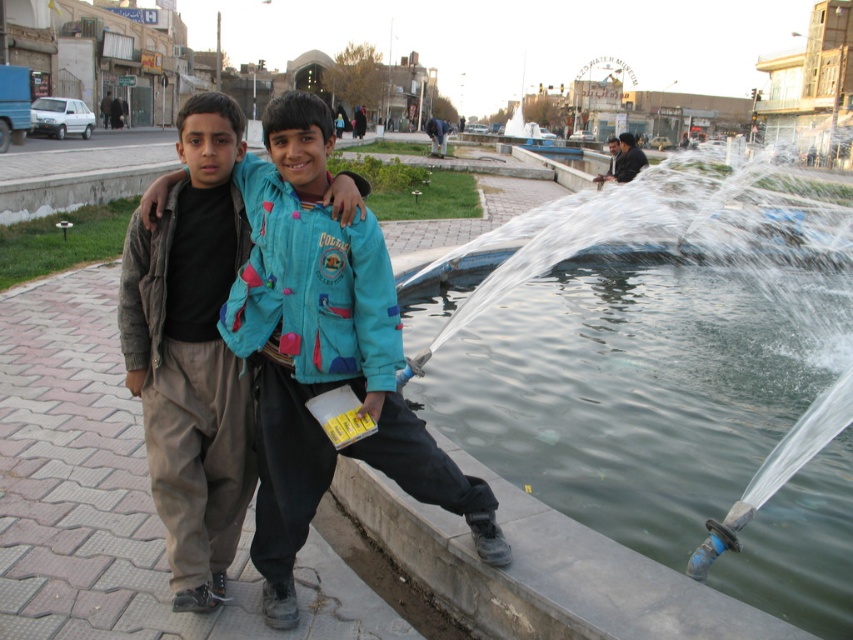
Does clear plastic water at center right appear under teal fabric jacket at center?

No, clear plastic water at center right is not below teal fabric jacket at center.

Is clear plastic water at center right positioned at the back of teal fabric jacket at center?

No, clear plastic water at center right is in front of teal fabric jacket at center.

Who is more distant from viewer, (756,390) or (280,304)?

The point (756,390) is behind.

Locate an element on the screen. The width and height of the screenshot is (853, 640). clear plastic water at center right is located at coordinates (665, 374).